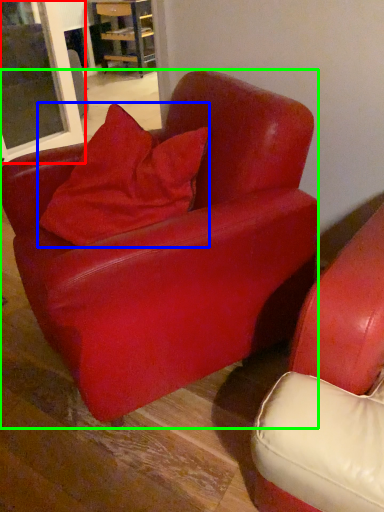
Question: Considering the real-world distances, which object is closest to window (highlighted by a red box)? pillow (highlighted by a blue box) or chair (highlighted by a green box).

Choices:
 (A) pillow
 (B) chair

Answer: (A)